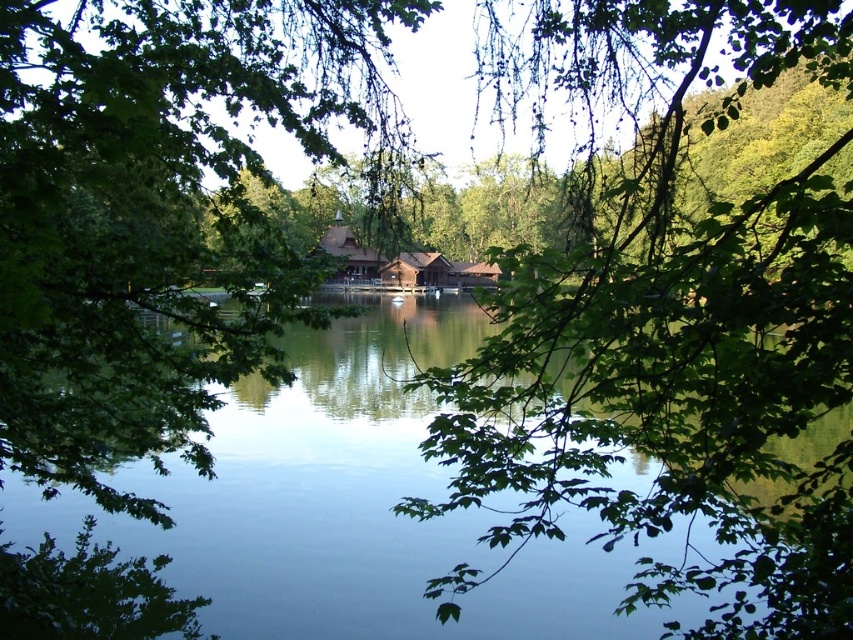
Question: Estimate the real-world distances between objects in this image. Which object is closer to the green leafy branch at center?

Choices:
 (A) green leafy tree at center
 (B) brown wooden cabin at center

Answer: (A)

Question: Does green leafy branch at center have a greater width compared to green leafy tree at center?

Choices:
 (A) no
 (B) yes

Answer: (A)

Question: Does green leafy branch at center have a larger size compared to green leafy tree at center?

Choices:
 (A) no
 (B) yes

Answer: (A)

Question: Which point is closer to the camera?

Choices:
 (A) brown wooden cabin at center
 (B) green leafy branch at center

Answer: (B)

Question: Is green leafy branch at center to the left of brown wooden cabin at center from the viewer's perspective?

Choices:
 (A) no
 (B) yes

Answer: (A)

Question: Which point is farther from the camera taking this photo?

Choices:
 (A) (811, 362)
 (B) (33, 272)

Answer: (A)